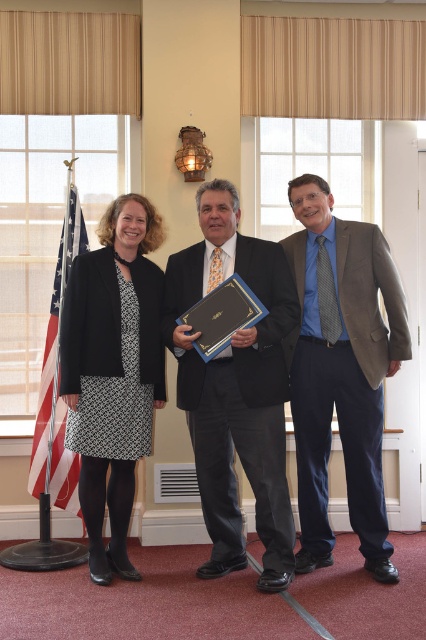
Which is more to the left, blue textured shirt at center or american flag at left?

american flag at left is more to the left.

Looking at this image, does blue textured shirt at center have a lesser height compared to american flag at left?

No, blue textured shirt at center is not shorter than american flag at left.

Which is in front, point (325, 321) or point (54, 403)?

Positioned in front is point (325, 321).

The image size is (426, 640). I want to click on blue textured shirt at center, so click(x=342, y=371).

Is point (91, 500) in front of point (232, 328)?

No, (91, 500) is further to viewer.

The image size is (426, 640). What are the coordinates of `black textured dress at left` in the screenshot? It's located at (112, 371).

Who is positioned more to the left, blue textured shirt at center or black textured dress at left?

black textured dress at left is more to the left.

Does blue textured shirt at center lie behind black textured dress at left?

No, blue textured shirt at center is in front of black textured dress at left.

Is point (397, 337) less distant than point (109, 416)?

No, (397, 337) is behind (109, 416).

The image size is (426, 640). In order to click on blue textured shirt at center in this screenshot , I will do `click(342, 371)`.